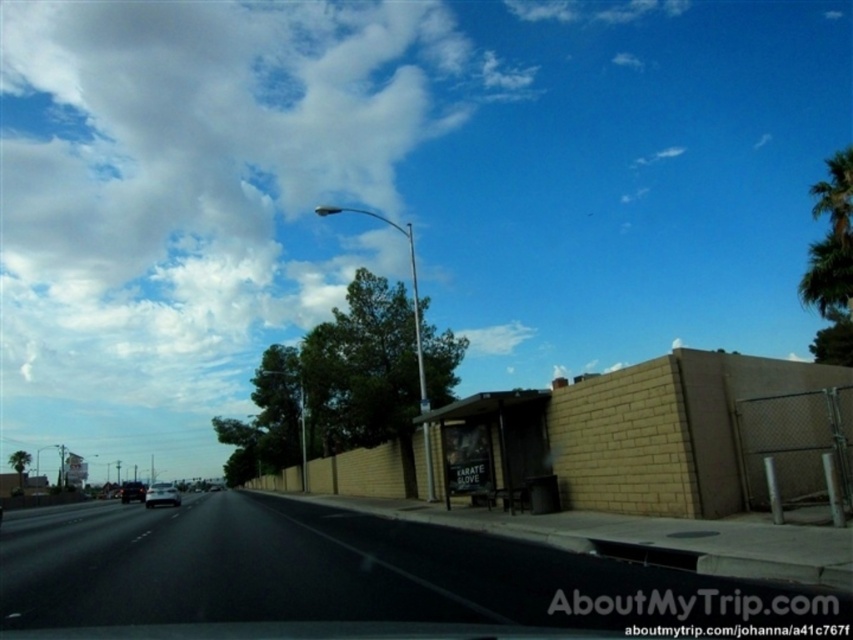
Who is shorter, black asphalt highway at center or silver metallic car at center?

black asphalt highway at center

Does black asphalt highway at center have a smaller size compared to silver metallic car at center?

Correct, black asphalt highway at center occupies less space than silver metallic car at center.

Which is in front, point (585, 621) or point (155, 499)?

Point (585, 621) is more forward.

You are a GUI agent. You are given a task and a screenshot of the screen. Output one action in this format:
    pyautogui.click(x=<x>, y=<y>)
    Task: Click on the black asphalt highway at center
    The height and width of the screenshot is (640, 853).
    Given the screenshot: What is the action you would take?
    pyautogui.click(x=357, y=576)

Does black asphalt highway at center have a greater height compared to silver metallic sedan at center?

Incorrect, black asphalt highway at center's height is not larger of silver metallic sedan at center's.

Is black asphalt highway at center thinner than silver metallic sedan at center?

Incorrect, black asphalt highway at center's width is not less than silver metallic sedan at center's.

Does point (190, 576) come closer to viewer compared to point (131, 484)?

Yes, point (190, 576) is in front of point (131, 484).

You are a GUI agent. You are given a task and a screenshot of the screen. Output one action in this format:
    pyautogui.click(x=<x>, y=<y>)
    Task: Click on the black asphalt highway at center
    This screenshot has width=853, height=640.
    Given the screenshot: What is the action you would take?
    pyautogui.click(x=357, y=576)

Based on the photo, between silver metallic car at center and silver metallic sedan at center, which one has less height?

silver metallic sedan at center

Is silver metallic car at center smaller than silver metallic sedan at center?

No.

Find the location of a particular element. The height and width of the screenshot is (640, 853). silver metallic car at center is located at coordinates (161, 493).

This screenshot has height=640, width=853. Find the location of `silver metallic car at center`. silver metallic car at center is located at coordinates (161, 493).